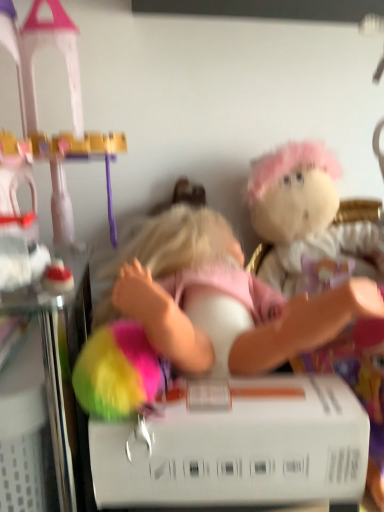
Find the location of a particular element. The height and width of the screenshot is (512, 384). fluffy white plush at upper right is located at coordinates (302, 213).

Describe the element at coordinates (238, 448) in the screenshot. I see `white matte box at center` at that location.

What are the coordinates of `fluffy white plush at upper right` in the screenshot? It's located at (302, 213).

From the image's perspective, is fluffy white plush at upper right on pink fabric doll at center?

Yes.

From the picture: From a real-world perspective, which object stands above the other?

In real-world perspective, fluffy white plush at upper right is above.

Is pink fabric doll at center at the back of fluffy white plush at upper right?

No, pink fabric doll at center is not at the back of fluffy white plush at upper right.

Does fluffy white plush at upper right have a lesser width compared to white matte box at center?

In fact, fluffy white plush at upper right might be wider than white matte box at center.

Considering the positions of objects fluffy white plush at upper right and white matte box at center in the image provided, who is more to the left, fluffy white plush at upper right or white matte box at center?

Answer: Positioned to the left is white matte box at center.

Is fluffy white plush at upper right closer to the viewer compared to white matte box at center?

No, fluffy white plush at upper right is behind white matte box at center.

Does point (268, 193) appear closer or farther from the camera than point (127, 446)?

Point (268, 193).

Which object is wider, pink fabric doll at center or fluffy white plush at upper right?

pink fabric doll at center.

Where is `person that appears below the fluffy white plush at upper right (from a real-world perspective)`? This screenshot has width=384, height=512. person that appears below the fluffy white plush at upper right (from a real-world perspective) is located at coordinates (303, 325).

From the image's perspective, which one is positioned higher, pink fabric doll at center or fluffy white plush at upper right?

fluffy white plush at upper right is shown above in the image.

In the scene shown: Is pink fabric doll at center facing towards fluffy white plush at upper right?

No, pink fabric doll at center is not turned towards fluffy white plush at upper right.

Is white matte box at center at the right side of pink fabric doll at center?

Yes, white matte box at center is to the right of pink fabric doll at center.

Is white matte box at center bigger than pink fabric doll at center?

Incorrect, white matte box at center is not larger than pink fabric doll at center.

Considering the sizes of white matte box at center and pink fabric doll at center in the image, is white matte box at center taller or shorter than pink fabric doll at center?

In the image, white matte box at center appears to be shorter than pink fabric doll at center.

From a real-world perspective, is white matte box at center located beneath pink fabric doll at center?

Yes, from a real-world perspective, white matte box at center is under pink fabric doll at center.

Which of these two, white matte box at center or fluffy white plush at upper right, stands taller?

With more height is fluffy white plush at upper right.

From a real-world perspective, is white matte box at center on top of fluffy white plush at upper right?

Actually, white matte box at center is physically below fluffy white plush at upper right in the real world.

Considering the relative sizes of white matte box at center and fluffy white plush at upper right in the image provided, is white matte box at center thinner than fluffy white plush at upper right?

Yes.

Is white matte box at center inside or outside of fluffy white plush at upper right?

white matte box at center cannot be found inside fluffy white plush at upper right.

Does pink fabric doll at center turn towards white matte box at center?

No.

Which is more to the left, pink fabric doll at center or white matte box at center?

pink fabric doll at center.

From a real-world perspective, which is physically below, pink fabric doll at center or white matte box at center?

white matte box at center, from a real-world perspective.

Where is `person below the fluffy white plush at upper right (from the image's perspective)`? The image size is (384, 512). person below the fluffy white plush at upper right (from the image's perspective) is located at coordinates (303, 325).

I want to click on toy located above the white matte box at center (from the image's perspective), so click(302, 213).

Looking at the image, which one is located closer to fluffy white plush at upper right, white matte box at center or pink fabric doll at center?

Among the two, pink fabric doll at center is located nearer to fluffy white plush at upper right.

From the image, which object appears to be nearer to pink fabric doll at center, white matte box at center or fluffy white plush at upper right?

The object closer to pink fabric doll at center is white matte box at center.

Looking at the image, which one is located further to white matte box at center, pink fabric doll at center or fluffy white plush at upper right?

fluffy white plush at upper right lies further to white matte box at center than the other object.

Which object lies nearer to the anchor point white matte box at center, fluffy white plush at upper right or pink fabric doll at center?

The object closer to white matte box at center is pink fabric doll at center.

Estimate the real-world distances between objects in this image. Which object is closer to fluffy white plush at upper right, pink fabric doll at center or white matte box at center?

pink fabric doll at center lies closer to fluffy white plush at upper right than the other object.

In the scene shown: Looking at the image, which one is located closer to pink fabric doll at center, fluffy white plush at upper right or white matte box at center?

white matte box at center.

Identify the location of person between fluffy white plush at upper right and white matte box at center vertically. This screenshot has width=384, height=512. (303, 325).